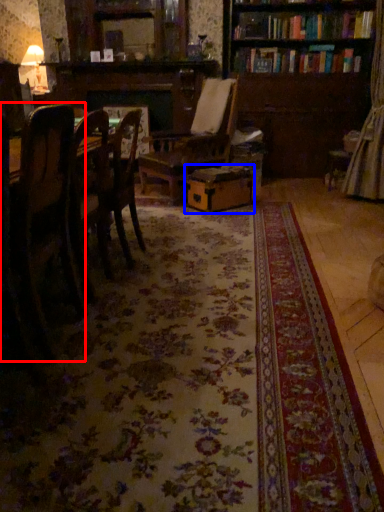
Question: Which object appears closest to the camera in this image, chair (highlighted by a red box) or cardboard box (highlighted by a blue box)?

Choices:
 (A) chair
 (B) cardboard box

Answer: (A)